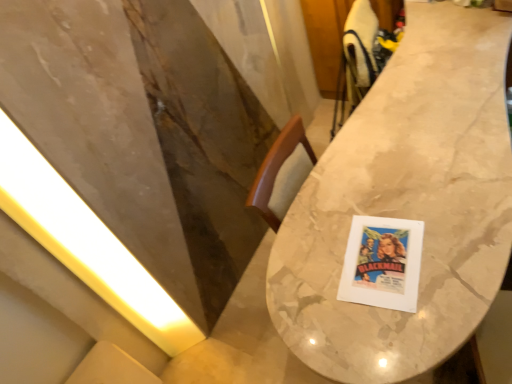
Question: Looking at their shapes, would you say marble table at center is wider or thinner than yellow matte light at left?

Choices:
 (A) thin
 (B) wide

Answer: (B)

Question: From the image's perspective, relative to yellow matte light at left, is marble table at center above or below?

Choices:
 (A) above
 (B) below

Answer: (A)

Question: Considering the positions of marble table at center and yellow matte light at left in the image, is marble table at center bigger or smaller than yellow matte light at left?

Choices:
 (A) big
 (B) small

Answer: (A)

Question: In the image, is yellow matte light at left positioned in front of or behind marble table at center?

Choices:
 (A) behind
 (B) front

Answer: (A)

Question: From a real-world perspective, is yellow matte light at left physically located above or below marble table at center?

Choices:
 (A) below
 (B) above

Answer: (B)

Question: Is yellow matte light at left bigger or smaller than marble table at center?

Choices:
 (A) big
 (B) small

Answer: (B)

Question: Is yellow matte light at left situated inside marble table at center or outside?

Choices:
 (A) inside
 (B) outside

Answer: (B)